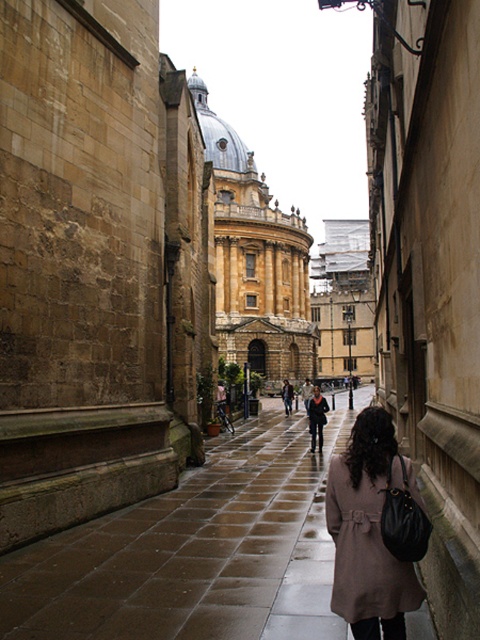
Looking at this image, you are a pedestrian trying to cross the street safely. You see a person wearing a brown matte trench coat at lower right and another wearing a matte black coat at center. Which coat is closer to you, the observer?

The brown matte trench coat at lower right is closer to you because it is positioned in front of the matte black coat at center.

You are a tourist standing in the middle of the street, and you want to take a photo of both the golden stone dome at center and the matte black coat at center. Which object should you adjust your camera to focus on first to ensure both are in the frame?

The golden stone dome at center is positioned on the left side of matte black coat at center. To ensure both are in the frame, focus on the matte black coat at center first, then adjust to include the golden stone dome at center on its left side.

You are a tourist standing in the middle of the street. You see the golden stone dome at center and the brown matte trench coat at lower right. Which object is taller?

The golden stone dome at center is taller than the brown matte trench coat at lower right.